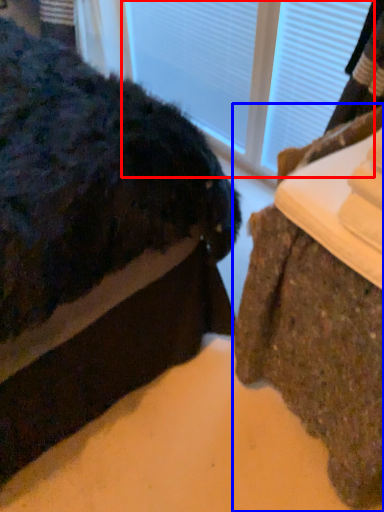
Question: Which object appears closest to the camera in this image, glass door (highlighted by a red box) or furniture (highlighted by a blue box)?

Choices:
 (A) glass door
 (B) furniture

Answer: (B)